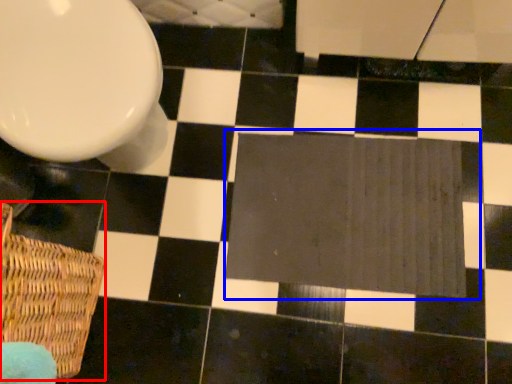
Question: Which of the following is the farthest to the observer, basket (highlighted by a red box) or bath mat (highlighted by a blue box)?

Choices:
 (A) basket
 (B) bath mat

Answer: (B)